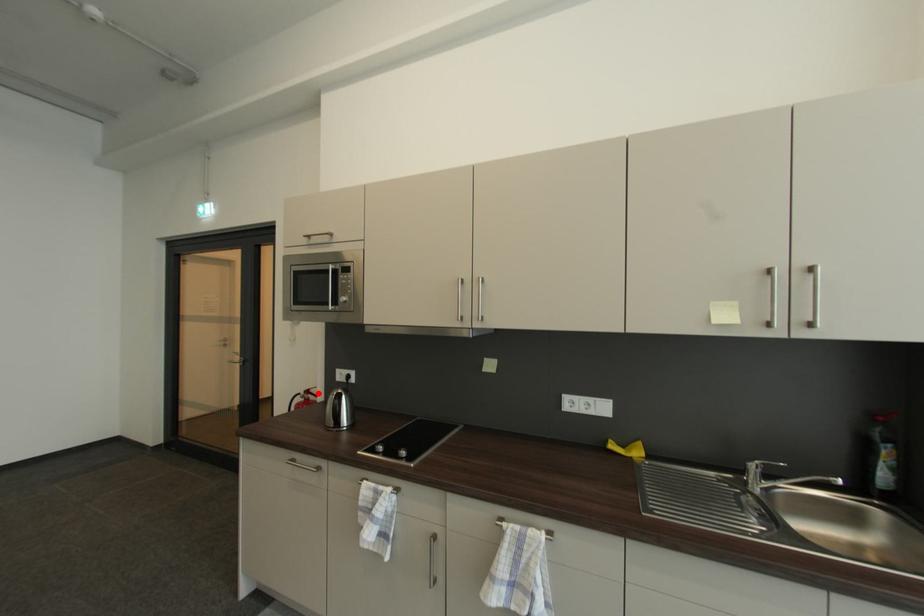
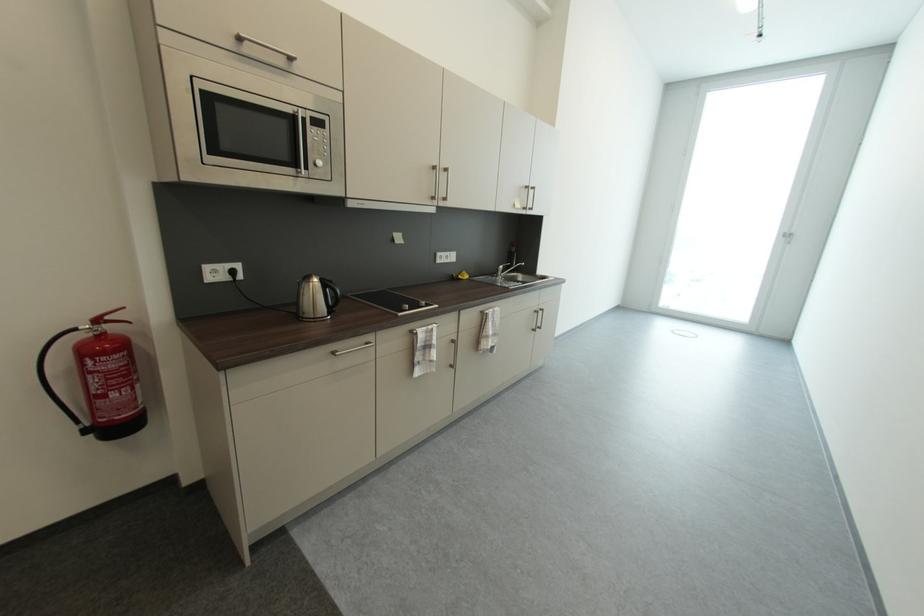
The point at the highlighted location is marked in the first image. Where is the corresponding point in the second image?

(116, 318)